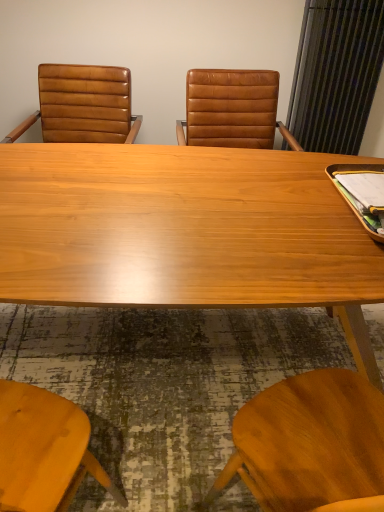
You are a GUI agent. You are given a task and a screenshot of the screen. Output one action in this format:
    pyautogui.click(x=<x>, y=<y>)
    Task: Click on the free spot above wooden desk at center (from a real-world perspective)
    
    Given the screenshot: What is the action you would take?
    pyautogui.click(x=134, y=193)